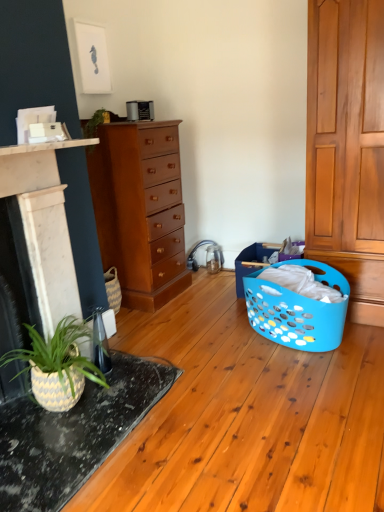
Question: Is mahogany wood chest of drawers at center facing towards speckled ceramic table at lower left?

Choices:
 (A) no
 (B) yes

Answer: (A)

Question: Does mahogany wood chest of drawers at center have a lesser width compared to speckled ceramic table at lower left?

Choices:
 (A) yes
 (B) no

Answer: (A)

Question: Does mahogany wood chest of drawers at center appear on the right side of speckled ceramic table at lower left?

Choices:
 (A) yes
 (B) no

Answer: (A)

Question: Is mahogany wood chest of drawers at center far away from speckled ceramic table at lower left?

Choices:
 (A) yes
 (B) no

Answer: (A)

Question: Can you confirm if mahogany wood chest of drawers at center is shorter than speckled ceramic table at lower left?

Choices:
 (A) yes
 (B) no

Answer: (B)

Question: Which is correct: speckled ceramic table at lower left is inside blue plastic laundry basket at lower right, or outside of it?

Choices:
 (A) inside
 (B) outside

Answer: (B)

Question: From the image's perspective, is speckled ceramic table at lower left above or below blue plastic laundry basket at lower right?

Choices:
 (A) below
 (B) above

Answer: (A)

Question: Is speckled ceramic table at lower left wider or thinner than blue plastic laundry basket at lower right?

Choices:
 (A) wide
 (B) thin

Answer: (A)

Question: From a real-world perspective, is speckled ceramic table at lower left physically located above or below blue plastic laundry basket at lower right?

Choices:
 (A) below
 (B) above

Answer: (A)

Question: From a real-world perspective, is blue plastic laundry basket at lower right physically located above or below mahogany wood chest of drawers at center?

Choices:
 (A) below
 (B) above

Answer: (A)

Question: Considering the positions of point (321, 279) and point (163, 204), is point (321, 279) closer or farther from the camera than point (163, 204)?

Choices:
 (A) farther
 (B) closer

Answer: (B)

Question: Looking at their shapes, would you say blue plastic laundry basket at lower right is wider or thinner than mahogany wood chest of drawers at center?

Choices:
 (A) wide
 (B) thin

Answer: (A)

Question: Would you say blue plastic laundry basket at lower right is inside or outside mahogany wood chest of drawers at center?

Choices:
 (A) inside
 (B) outside

Answer: (B)

Question: Would you say mahogany wood chest of drawers at center is to the left or to the right of white marble fireplace at left in the picture?

Choices:
 (A) left
 (B) right

Answer: (B)

Question: From the image's perspective, is mahogany wood chest of drawers at center positioned above or below white marble fireplace at left?

Choices:
 (A) below
 (B) above

Answer: (B)